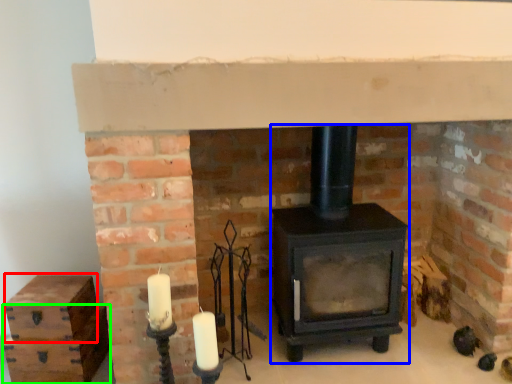
Question: Which object is positioned farthest from drawer (highlighted by a red box)? Select from wood burning stove (highlighted by a blue box) and drawer (highlighted by a green box).

Choices:
 (A) wood burning stove
 (B) drawer

Answer: (A)